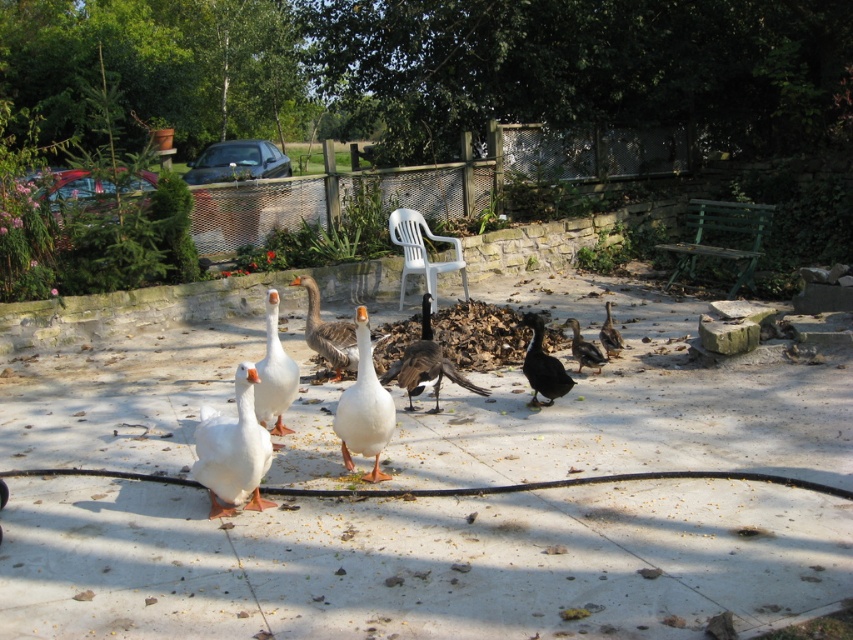
Question: Based on their relative distances, which object is nearer to the dark brown duck at center?

Choices:
 (A) white plastic chair at center
 (B) brown matte duck at center

Answer: (B)

Question: Is white matte duck at lower left in front of gray matte goose at center?

Choices:
 (A) yes
 (B) no

Answer: (A)

Question: From the image, what is the correct spatial relationship of green wooden bench at center right in relation to white glossy goose at center?

Choices:
 (A) below
 (B) above

Answer: (B)

Question: Can you confirm if dark brown glossy duck at center is positioned to the left of dark brown duck at center?

Choices:
 (A) no
 (B) yes

Answer: (B)

Question: Which point appears farthest from the camera in this image?

Choices:
 (A) (364, 422)
 (B) (271, 502)
 (C) (587, 355)
 (D) (267, 342)

Answer: (C)

Question: Among these points, which one is nearest to the camera?

Choices:
 (A) (554, 397)
 (B) (418, 224)

Answer: (A)